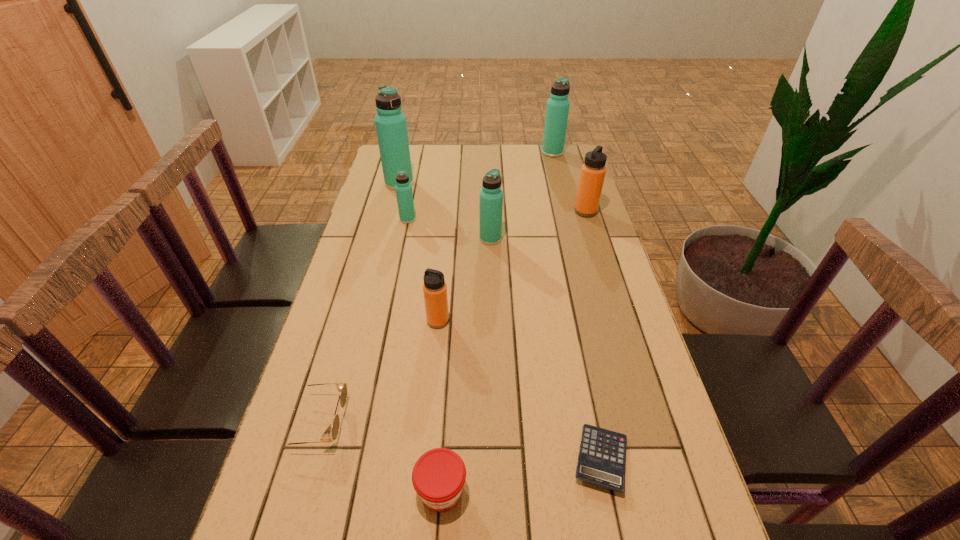
Where is `the biggest aqua thermos bottle`? The height and width of the screenshot is (540, 960). the biggest aqua thermos bottle is located at coordinates (390, 122).

Where is `the fifth nearest thermos bottle`? Image resolution: width=960 pixels, height=540 pixels. the fifth nearest thermos bottle is located at coordinates (390, 122).

In order to click on the farthest object in this screenshot , I will do `click(557, 109)`.

Where is `the rightmost aqua thermos bottle`? the rightmost aqua thermos bottle is located at coordinates (557, 109).

This screenshot has height=540, width=960. I want to click on the right orange thermos bottle, so click(593, 170).

Image resolution: width=960 pixels, height=540 pixels. I want to click on the bigger orange thermos bottle, so click(x=593, y=170).

You are a GUI agent. You are given a task and a screenshot of the screen. Output one action in this format:
    pyautogui.click(x=<x>, y=<y>)
    Task: Click on the fourth object from right to left
    The width and height of the screenshot is (960, 540).
    Given the screenshot: What is the action you would take?
    pos(491,196)

Identify the location of the fourth thermos bottle from left to right. (491, 196).

Image resolution: width=960 pixels, height=540 pixels. I want to click on the smallest aqua thermos bottle, so (x=404, y=194).

At what (x,y) coordinates should I click in order to perform the action: click on the fourth thermos bottle from right to left. Please return your answer as a coordinate pair (x, y). This screenshot has width=960, height=540. Looking at the image, I should click on (434, 288).